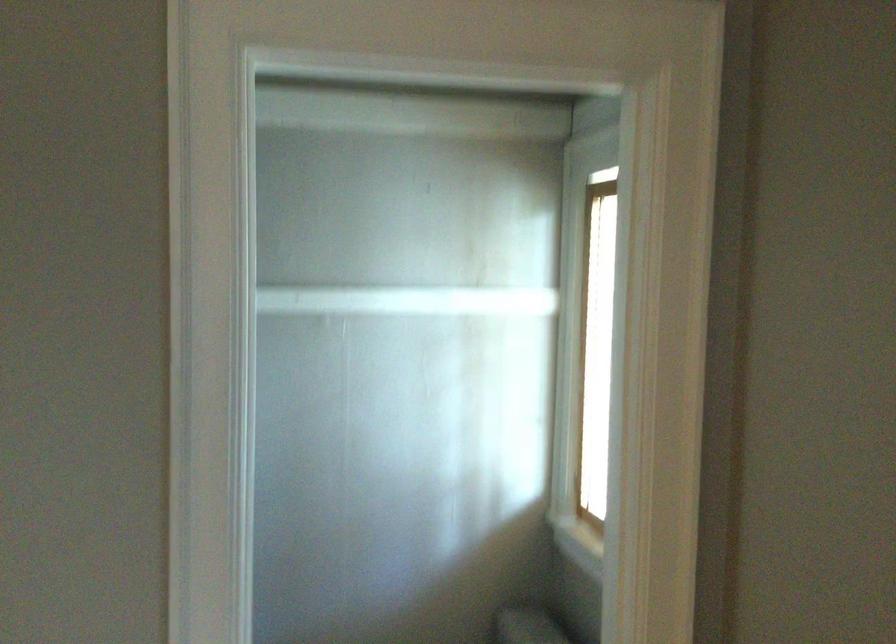
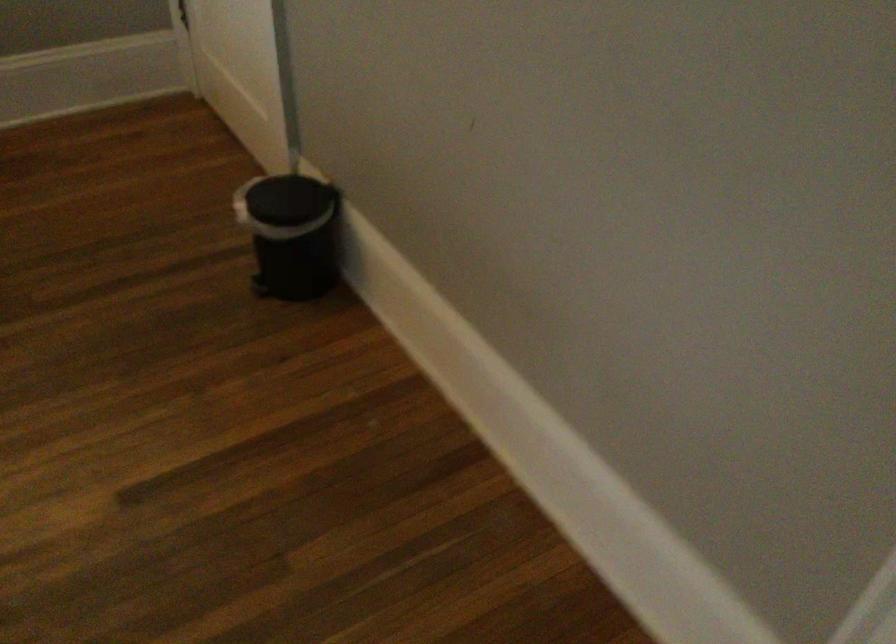
How did the camera likely rotate?

The camera rotated toward left-down.